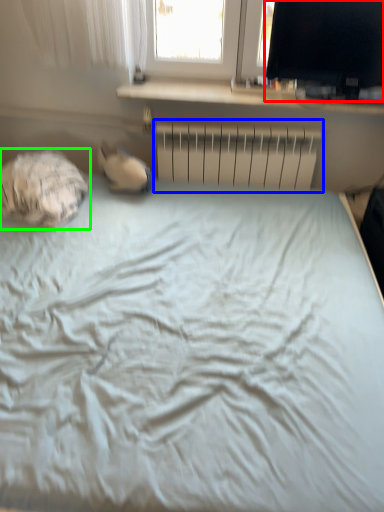
Question: Estimate the real-world distances between objects in this image. Which object is farther from computer monitor (highlighted by a red box), radiator (highlighted by a blue box) or sleeping bag (highlighted by a green box)?

Choices:
 (A) radiator
 (B) sleeping bag

Answer: (B)